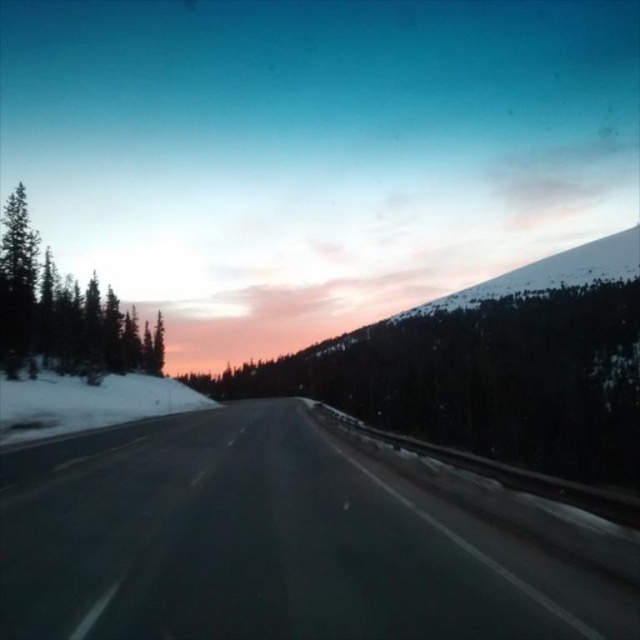
You are a driver approaching the black asphalt highway at center and the green matte tree at left. Which object is closer to your right side when driving forward?

The black asphalt highway at center is to the right of the green matte tree at left, so when driving forward, the black asphalt highway at center will be closer to your right side.

You are a driver in a car and you see the point at coordinates [266,545]. What does this point represent?

The point at coordinates [266,545] corresponds to the black asphalt highway at center.

You are a driver in a car and you want to stay on the black asphalt highway at center. Based on the scene, where should you position your car to stay on the road?

The black asphalt highway at center is located at point (266, 545), so you should position your car near that coordinate to stay on the road.